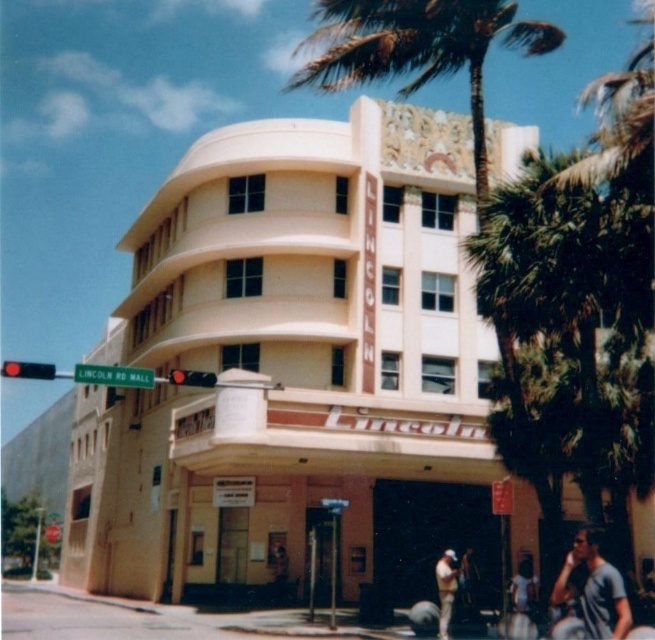
Is point (614, 605) in front of point (519, 579)?

Yes, point (614, 605) is closer to viewer.

Is gray cotton t-shirt at lower right smaller than light blue jeans at lower right?

Yes, gray cotton t-shirt at lower right is smaller than light blue jeans at lower right.

Locate an element on the screen. The image size is (655, 640). gray cotton t-shirt at lower right is located at coordinates (593, 588).

Image resolution: width=655 pixels, height=640 pixels. What are the coordinates of `gray cotton t-shirt at lower right` in the screenshot? It's located at (593, 588).

Which is in front, point (531, 621) or point (441, 596)?

Point (531, 621) is more forward.

Who is more distant from viewer, (527, 609) or (458, 572)?

The point (458, 572) is more distant.

Locate an element on the screen. This screenshot has height=640, width=655. light blue jeans at lower right is located at coordinates [x=521, y=600].

Between beige concrete building at center and green metal street sign at upper center, which one appears on the right side from the viewer's perspective?

From the viewer's perspective, beige concrete building at center appears more on the right side.

Can you confirm if beige concrete building at center is positioned to the right of green metal street sign at upper center?

Yes, beige concrete building at center is to the right of green metal street sign at upper center.

This screenshot has width=655, height=640. What do you see at coordinates (286, 353) in the screenshot?
I see `beige concrete building at center` at bounding box center [286, 353].

You are a GUI agent. You are given a task and a screenshot of the screen. Output one action in this format:
    pyautogui.click(x=<x>, y=<y>)
    Task: Click on the beige concrete building at center
    This screenshot has height=640, width=655.
    Given the screenshot: What is the action you would take?
    pyautogui.click(x=286, y=353)